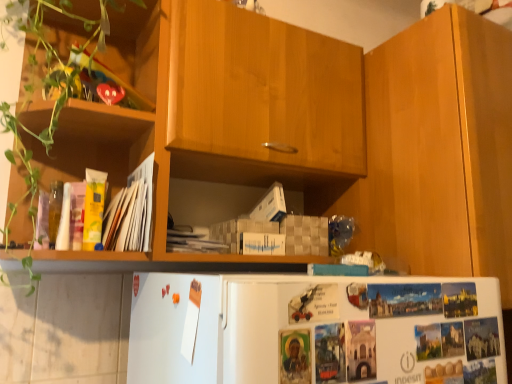
Question: From the image's perspective, is yellow paper at left positioned above or below wooden cabinet at right?

Choices:
 (A) above
 (B) below

Answer: (B)

Question: Relative to wooden cabinet at right, is yellow paper at left in front or behind?

Choices:
 (A) front
 (B) behind

Answer: (A)

Question: Which of these objects is positioned farthest from the yellow paper at left?

Choices:
 (A) wooden cabinet at right
 (B) green matte plant at left

Answer: (A)

Question: Which object is the closest to the wooden cabinet at right?

Choices:
 (A) green matte plant at left
 (B) yellow paper at left

Answer: (B)